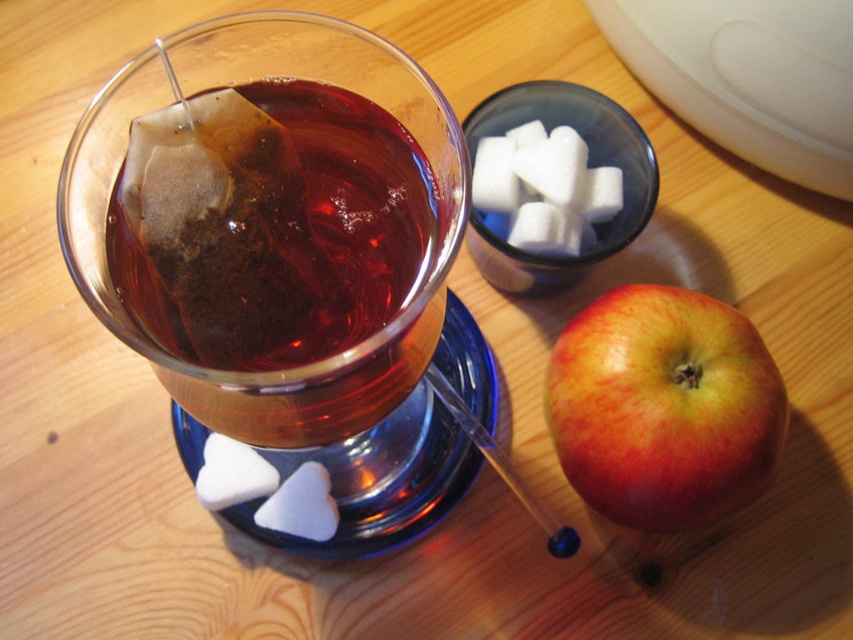
You are a person with a 12 inch long arm. You want to reach the point at coordinates point (115, 189) on the table. Can you reach it with your arm?

The point point (115, 189) is 10.76 inches from the viewer, so yes, the person can reach it with their 12 inch long arm since it is within reach.

You are looking at the wooden surface and want to place a small sticker on the point that is closer to you. Which point should you choose between point (376, 250) and point (589, 339)?

Point (376, 250) is closer to the camera, so you should choose point (376, 250) to place the sticker.

You are a person sitting at the wooden table and want to reach for the translucent paper tea bag at upper left. Which direction should you move your hand to grab it?

You should move your hand to the upper left direction to grab the translucent paper tea bag at upper left.